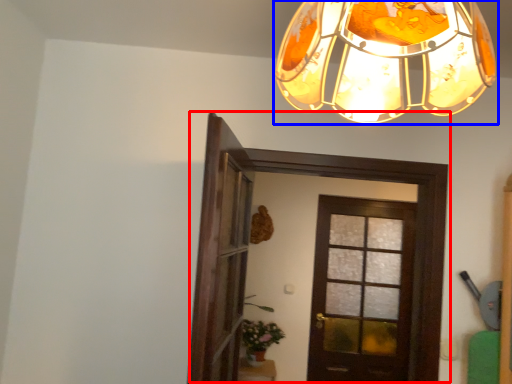
Question: Which object appears closest to the camera in this image, door (highlighted by a red box) or lamp (highlighted by a blue box)?

Choices:
 (A) door
 (B) lamp

Answer: (B)